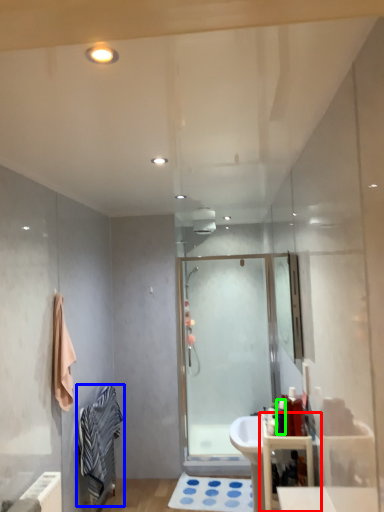
Question: Estimate the real-world distances between objects in this image. Which object is farther from bathroom cabinet (highlighted by a red box), bathrobe (highlighted by a blue box) or toiletry (highlighted by a green box)?

Choices:
 (A) bathrobe
 (B) toiletry

Answer: (A)